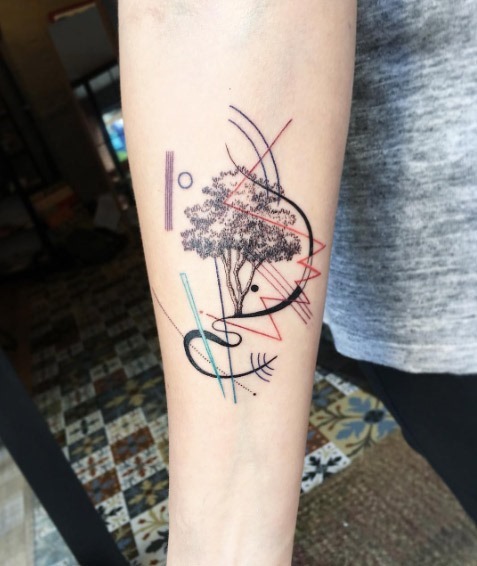
I want to click on carpet, so click(410, 505).